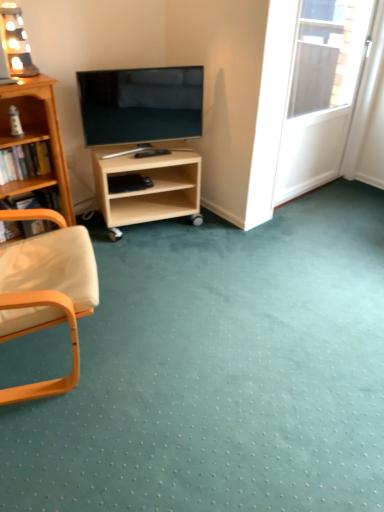
Where is `vacant space in between wooden armchair at left and white glossy screen door at upper right`? The height and width of the screenshot is (512, 384). vacant space in between wooden armchair at left and white glossy screen door at upper right is located at coordinates (196, 266).